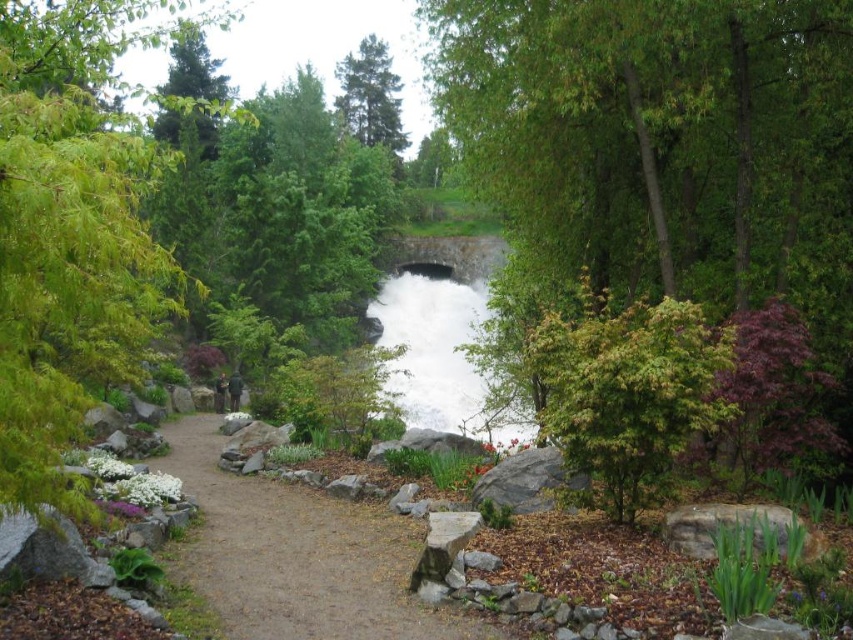
Question: Based on their relative distances, which object is farther from the green matte tree at upper left?

Choices:
 (A) brown dirt path at center
 (B) green leafy tree at center right

Answer: (B)

Question: Does brown dirt path at center have a smaller size compared to green matte tree at upper left?

Choices:
 (A) no
 (B) yes

Answer: (B)

Question: Does brown dirt path at center appear on the left side of green matte tree at upper left?

Choices:
 (A) yes
 (B) no

Answer: (B)

Question: Which object is closer to the camera taking this photo?

Choices:
 (A) green leafy tree at left
 (B) green leafy tree at center right

Answer: (A)

Question: Where is green leafy tree at left located in relation to green matte tree at upper left in the image?

Choices:
 (A) right
 (B) left

Answer: (B)

Question: Based on their relative distances, which object is farther from the green leafy tree at center right?

Choices:
 (A) green leafy tree at left
 (B) green matte tree at upper left
 (C) brown dirt path at center

Answer: (B)